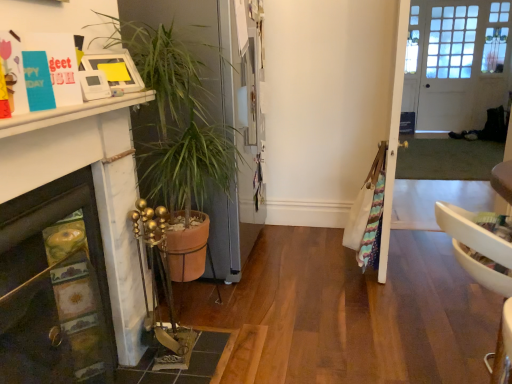
Locate an element on the screen. This screenshot has height=384, width=512. free spot to the right of matte brown tile at lower left is located at coordinates (263, 345).